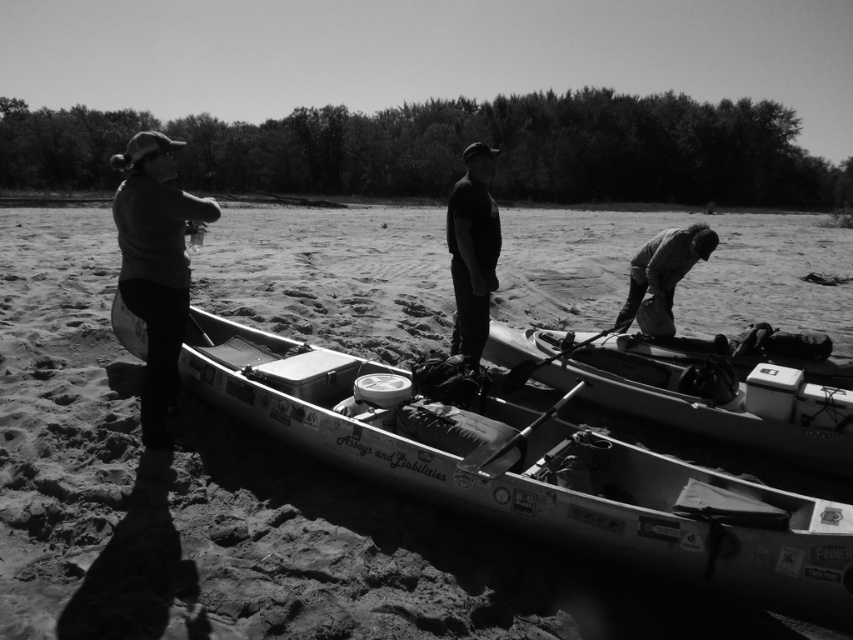
You are standing at the origin point of the coordinate system. You want to move towards the smooth plastic canoe at center. What are the coordinates you need to navigate to?

The coordinates you need to navigate to are 0.631 on the x axis and 0.843 on the y axis.

You are standing at the origin point of the coordinate system. You want to move to the metallic kayak at center. What are the coordinates you need to move to?

The coordinates to move to are 0.744 in the x direction and 0.633 in the y direction.

You are a photographer standing at the edge of the riverbank. You want to take a photo of the black matte shirt at center and the dark fabric jacket at lower right. Which object should you focus on first to ensure both are in focus?

You should focus on the black matte shirt at center first because it is closer to the viewer than the dark fabric jacket at lower right. By focusing on the closer object, the depth of field may include both in focus.